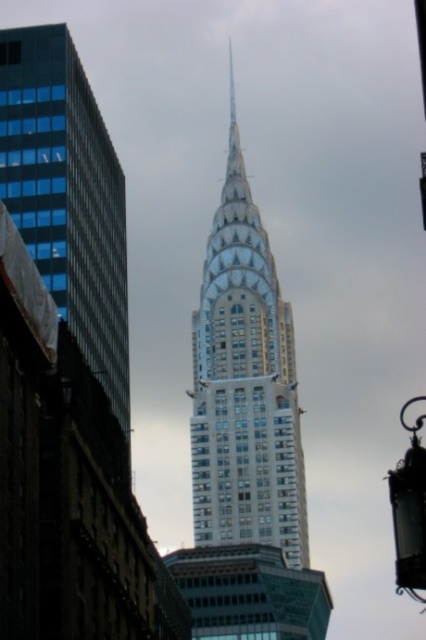
You are standing on the sidewalk in front of the Chrysler Building and see the glassy steel skyscraper at center and the glassy blue skyscraper at left. Which skyscraper is more to the left?

The glassy blue skyscraper at left is more to the left.

You are standing on the street looking at the Chrysler Building complex. You notice two skyscrapers in front of you, the glassy steel skyscraper at center and the glassy blue skyscraper at left. Which one do you think is taller?

The glassy steel skyscraper at center is taller than the glassy blue skyscraper at left.

You are standing at the point marked by point (244,384). Looking around, you see the Chrysler Building. What is the most prominent feature directly in front of you?

The point (244,384) indicates the glassy steel skyscraper at center, which is the Chrysler Building. The most prominent feature directly in front of you would be its distinctive Art Deco spire reaching high into the sky.